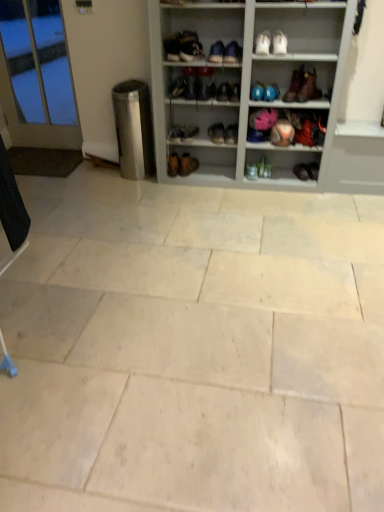
Locate an element on the screen. Image resolution: width=384 pixels, height=512 pixels. vacant area that is situated to the right of matte blue shoe at center, which is the seventh footwear from right to left is located at coordinates (286, 177).